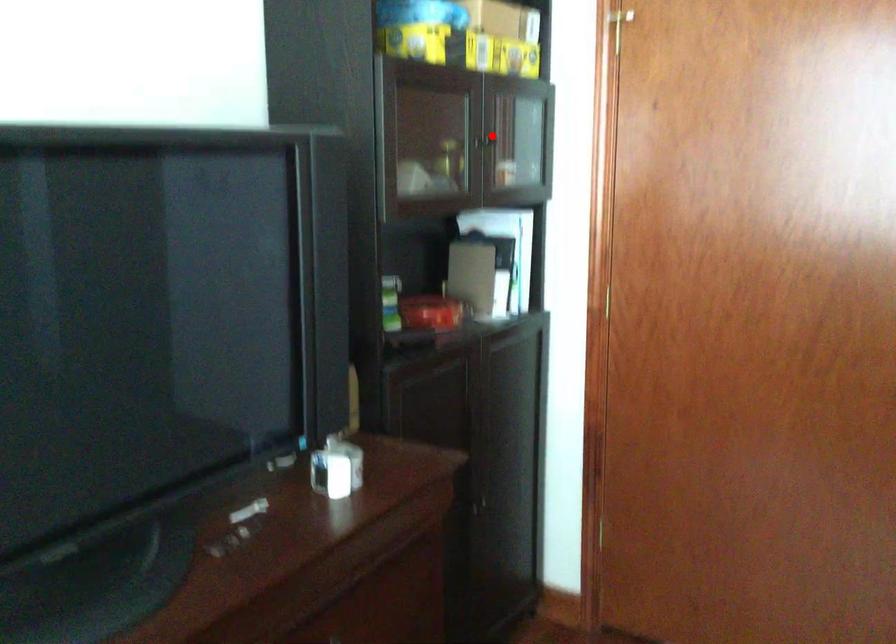
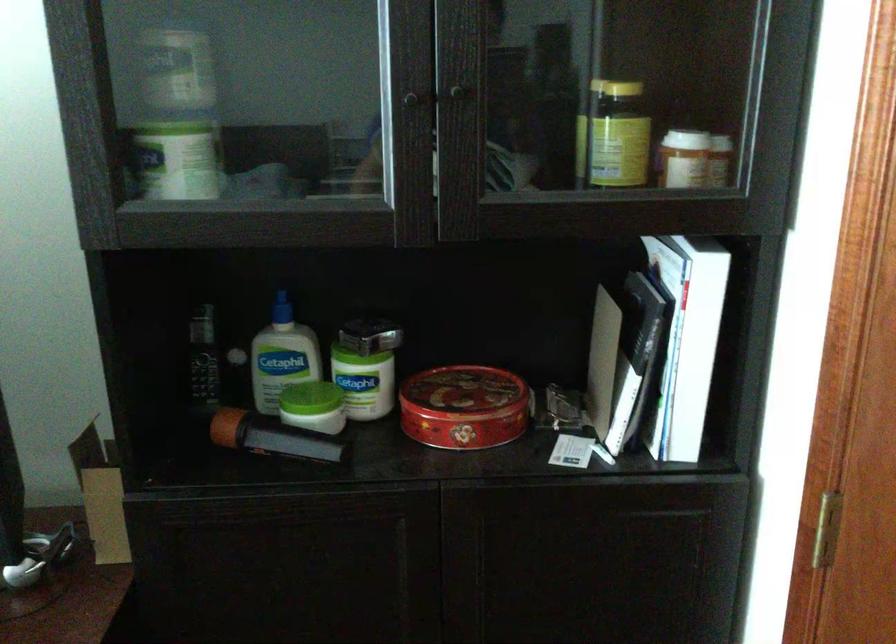
Question: I am providing you with two images of the same scene from different viewpoints. In image1, a red point is highlighted. Considering the same 3D point in image2, which of the following is correct?

Choices:
 (A) It is closer
 (B) It is farther

Answer: (A)